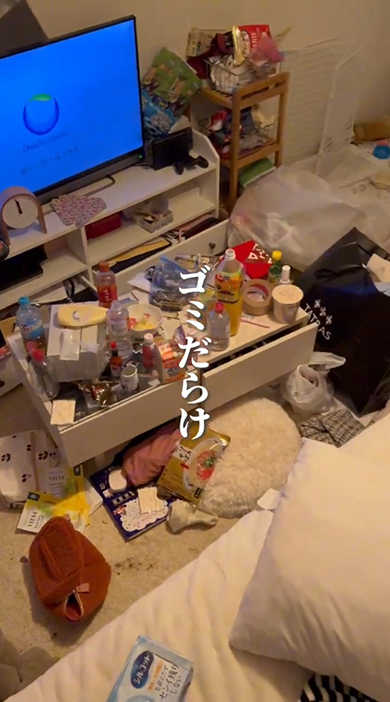
This screenshot has height=702, width=390. In order to click on bed in this screenshot , I will do `click(206, 623)`.